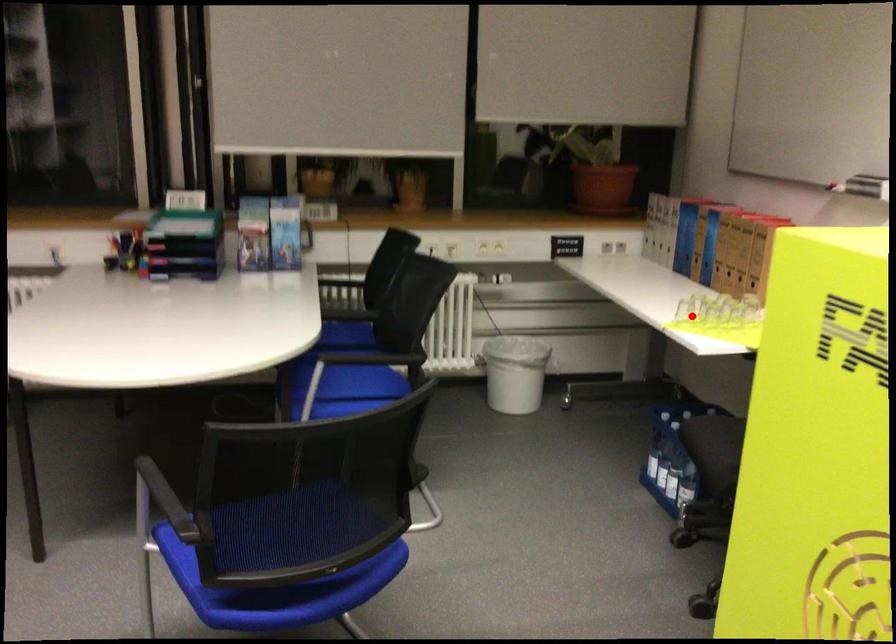
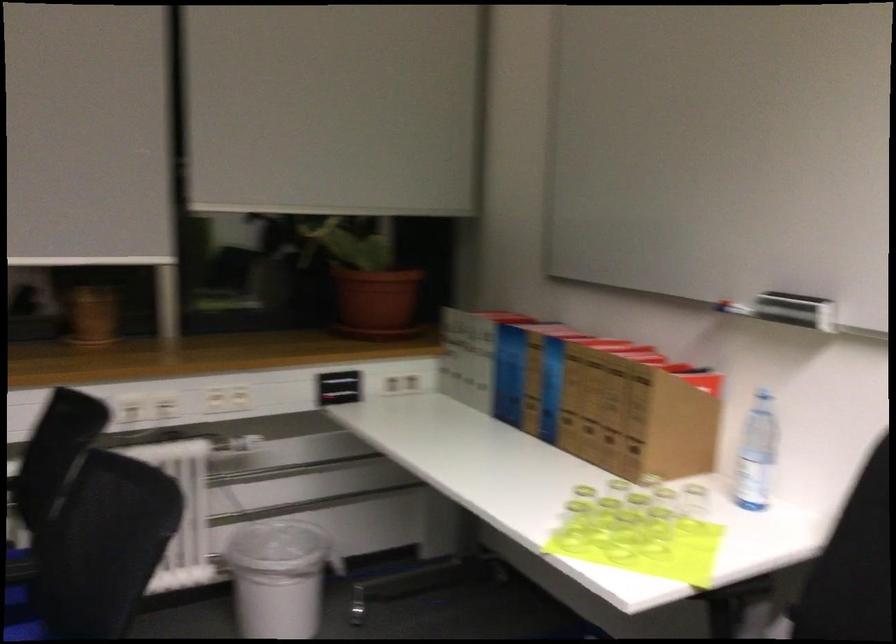
Locate, in the second image, the point that corresponds to the highlighted location in the first image.

(573, 526)